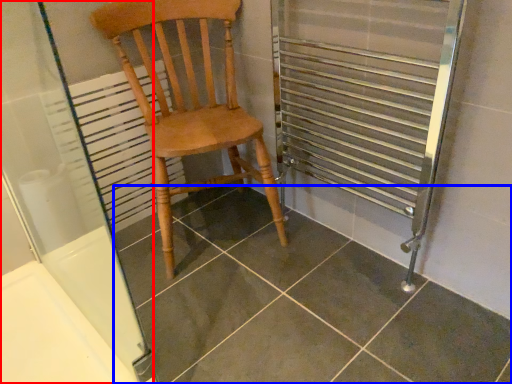
Question: Which object appears farthest to the camera in this image, screen door (highlighted by a red box) or tile (highlighted by a blue box)?

Choices:
 (A) screen door
 (B) tile

Answer: (B)